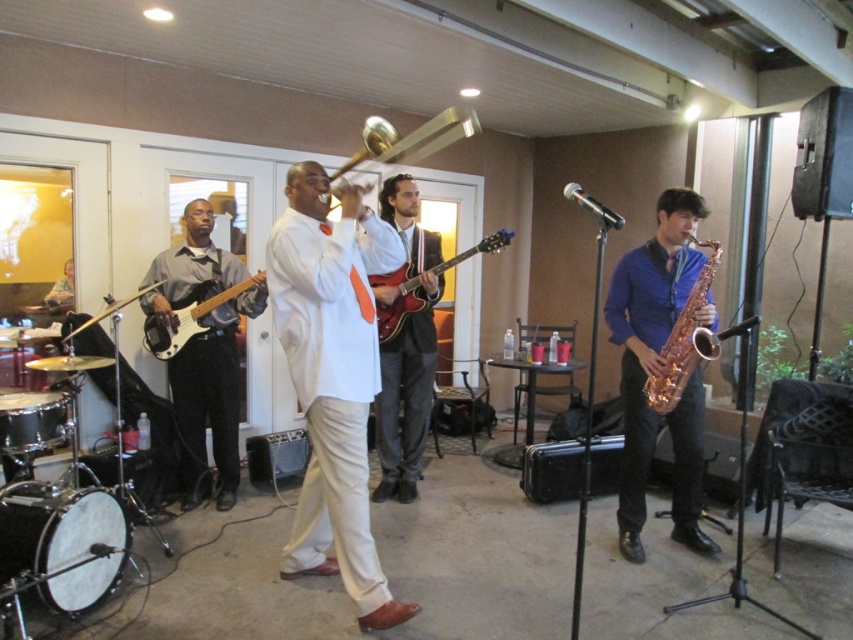
You are a stagehand needing to place a 1.2 meter long equipment cart between the white satin suit at center and the matte black bass guitar at left. Can the cart fit there?

The distance between the white satin suit at center and the matte black bass guitar at left is 1.11 meters, which is shorter than the cart length of 1.2 meters. The cart cannot fit there.

From the picture: You are a stagehand setting up for a live performance. You need to place a new amplifier that is 1.2 meters wide between the rose gold saxophone at right and the matte black bass guitar at left. Based on the space between them, will the amplifier fit?

The rose gold saxophone at right has a smaller size compared to matte black bass guitar at left, but the description does not provide information about the distance between them. Therefore, it is unclear if the amplifier will fit.